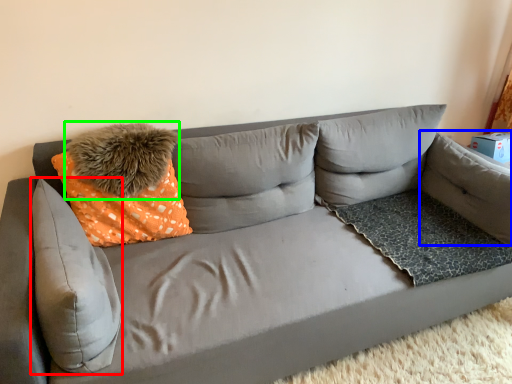
Question: Based on their relative distances, which object is nearer to pillow (highlighted by a red box)? Choose from pillow (highlighted by a blue box) and pillow (highlighted by a green box).

Choices:
 (A) pillow
 (B) pillow

Answer: (B)